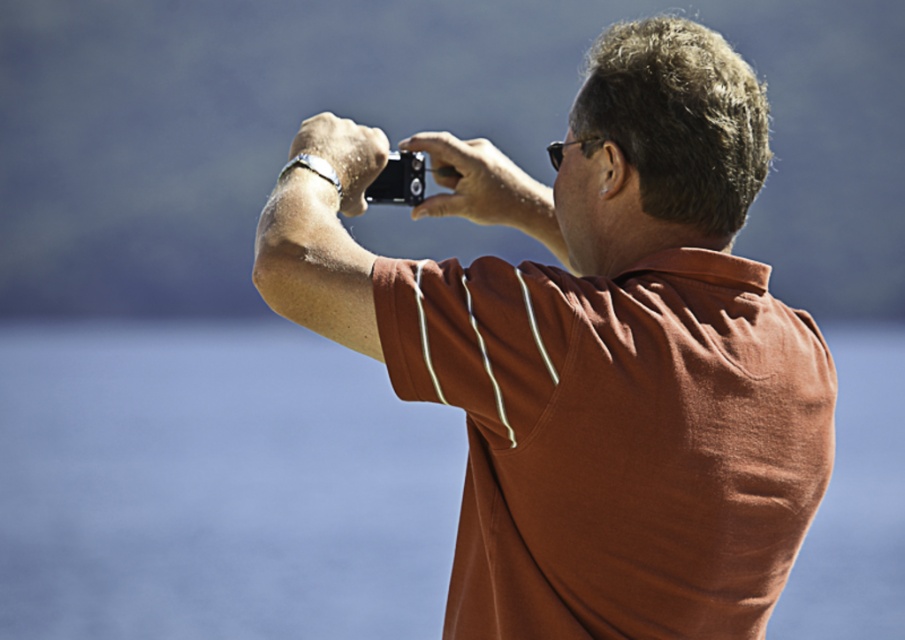
Question: Among these objects, which one is farthest from the camera?

Choices:
 (A) matte black camera at center
 (B) transparent blue water at center

Answer: (B)

Question: Is matte black camera at center above black plastic camera at center?

Choices:
 (A) no
 (B) yes

Answer: (A)

Question: Which point is farther to the camera?

Choices:
 (A) matte black camera at center
 (B) black plastic camera at center
 (C) transparent blue water at center

Answer: (C)

Question: Is transparent blue water at center bigger than black plastic camera at center?

Choices:
 (A) yes
 (B) no

Answer: (A)

Question: Where is matte black camera at center located in relation to black plastic camera at center in the image?

Choices:
 (A) left
 (B) right

Answer: (B)

Question: Which point is farther to the camera?

Choices:
 (A) (405, 182)
 (B) (494, 413)

Answer: (A)